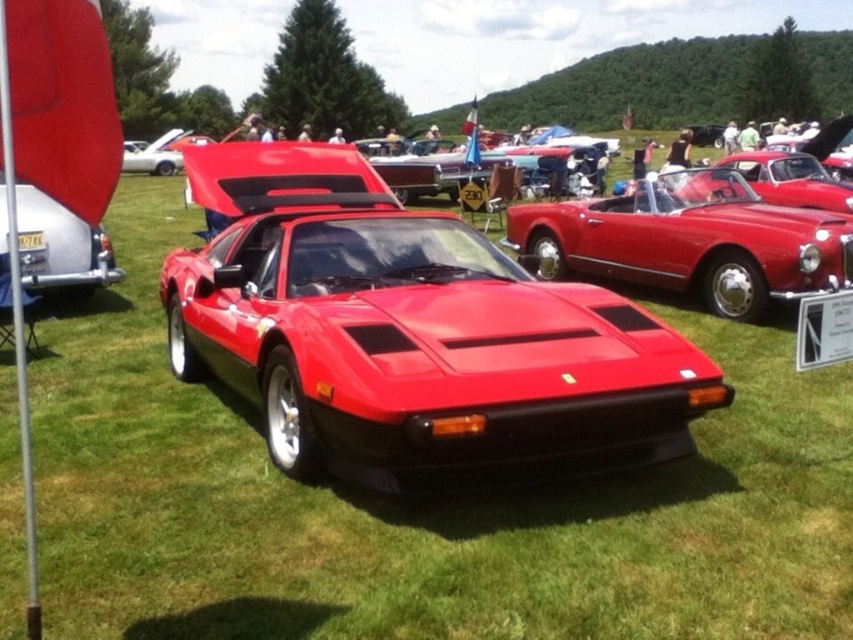
Question: Which is farther from the metallic silver license plate at left?

Choices:
 (A) shiny red sports car at center
 (B) glossy red convertible at center

Answer: (B)

Question: Which of these objects is positioned farthest from the metallic silver license plate at left?

Choices:
 (A) shiny red sports car at center
 (B) glossy red convertible at center

Answer: (B)

Question: Is glossy red convertible at center further to the viewer compared to metallic silver license plate at left?

Choices:
 (A) no
 (B) yes

Answer: (B)

Question: Does shiny red sports car at center appear on the left side of metallic silver license plate at left?

Choices:
 (A) no
 (B) yes

Answer: (A)

Question: Is glossy red convertible at center below metallic silver license plate at left?

Choices:
 (A) yes
 (B) no

Answer: (B)

Question: Which of the following is the closest to the observer?

Choices:
 (A) glossy red convertible at center
 (B) shiny red sports car at center

Answer: (B)